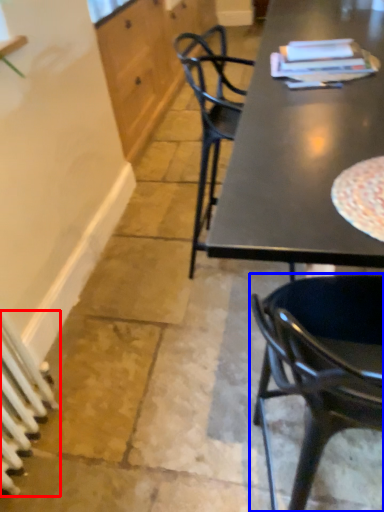
Question: Which of the following is the farthest to the observer, radiator (highlighted by a red box) or chair (highlighted by a blue box)?

Choices:
 (A) radiator
 (B) chair

Answer: (A)